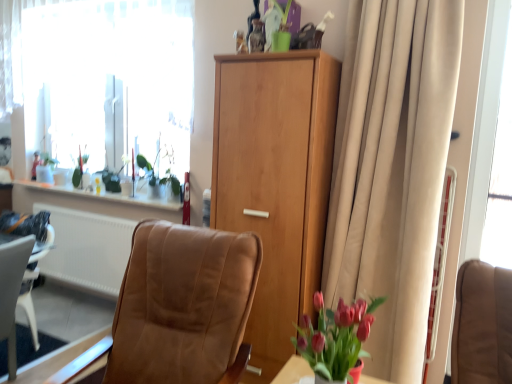
At what (x,y) coordinates should I click in order to perform the action: click on leather-like brown chair at center. Please return your answer as a coordinate pair (x, y). This screenshot has height=384, width=512. Looking at the image, I should click on (179, 308).

How much space does green matte plant at upper left, which is the second plant in left-to-right order, occupy vertically?

green matte plant at upper left, which is the second plant in left-to-right order, is 20.73 inches tall.

This screenshot has height=384, width=512. What do you see at coordinates (276, 183) in the screenshot?
I see `light brown wood cabinet at center` at bounding box center [276, 183].

Measure the distance between light brown wood cabinet at center and camera.

The distance of light brown wood cabinet at center from camera is 2.08 meters.

I want to click on white matte radiator at lower left, so tap(87, 249).

Is white matte radiator at lower left not within beige fabric curtain at right?

white matte radiator at lower left lies outside beige fabric curtain at right's area.

What's the angular difference between white matte radiator at lower left and beige fabric curtain at right's facing directions?

The angle between the facing direction of white matte radiator at lower left and the facing direction of beige fabric curtain at right is 0.869 degrees.

Is white matte radiator at lower left in contact with beige fabric curtain at right?

They are not placed beside each other.

At what (x,y) coordinates should I click in order to perform the action: click on curtain that is above the white matte radiator at lower left (from a real-world perspective). Please return your answer as a coordinate pair (x, y). Looking at the image, I should click on (460, 163).

Identify the location of chair that appears in front of the green matte plant at upper left, which is the second plant in left-to-right order. This screenshot has height=384, width=512. (179, 308).

Can you confirm if leather-like brown chair at center is thinner than green matte plant at upper left, which is the 1th plant from front to back?

No, leather-like brown chair at center is not thinner than green matte plant at upper left, which is the 1th plant from front to back.

From the image's perspective, is leather-like brown chair at center beneath green matte plant at upper left, marked as the first plant in a right-to-left arrangement?

Yes, from the image's perspective, leather-like brown chair at center is beneath green matte plant at upper left, marked as the first plant in a right-to-left arrangement.

From a real-world perspective, is leather-like brown chair at center below green matte plant at upper left, marked as the first plant in a right-to-left arrangement?

Correct, in the physical world, leather-like brown chair at center is lower than green matte plant at upper left, marked as the first plant in a right-to-left arrangement.

Is green glossy vase at upper left, the 1th plant when ordered from left to right, located within leather-like brown chair at center?

No.

In the scene shown: Is leather-like brown chair at center oriented away from green glossy vase at upper left, the 1th plant when ordered from left to right?

leather-like brown chair at center does not have its back to green glossy vase at upper left, the 1th plant when ordered from left to right.

Which object is further away from the camera, leather-like brown chair at center or green glossy vase at upper left, marked as the second plant in a right-to-left arrangement?

green glossy vase at upper left, marked as the second plant in a right-to-left arrangement, is behind.

Considering the sizes of objects beige fabric curtain at right and white matte radiator at lower left in the image provided, who is taller, beige fabric curtain at right or white matte radiator at lower left?

With more height is beige fabric curtain at right.

Can you tell me how much beige fabric curtain at right and white matte radiator at lower left differ in facing direction?

0.869 degrees separate the facing orientations of beige fabric curtain at right and white matte radiator at lower left.

Who is smaller, beige fabric curtain at right or white matte radiator at lower left?

Smaller between the two is white matte radiator at lower left.

Is point (396, 265) closer to camera compared to point (58, 159)?

Yes, it is in front of point (58, 159).

Looking at their sizes, would you say beige fabric curtain at right is wider or thinner than white sheer curtain at upper left?

Considering their sizes, beige fabric curtain at right looks broader than white sheer curtain at upper left.

From the image's perspective, which is below, beige fabric curtain at right or white sheer curtain at upper left?

beige fabric curtain at right appears lower in the image.

Is white sheer curtain at upper left inside beige fabric curtain at right?

No.

Considering the points (73, 212) and (85, 32), which point is in front, point (73, 212) or point (85, 32)?

Positioned in front is point (85, 32).

Is white matte radiator at lower left wider or thinner than white sheer curtain at upper left?

white matte radiator at lower left is thinner than white sheer curtain at upper left.

Which is more to the right, white matte radiator at lower left or white sheer curtain at upper left?

white sheer curtain at upper left.

From a real-world perspective, is transparent glass window screen at right below green matte plant at upper left, marked as the first plant in a right-to-left arrangement?

No, from a real-world perspective, transparent glass window screen at right is not under green matte plant at upper left, marked as the first plant in a right-to-left arrangement.

Is transparent glass window screen at right inside or outside of green matte plant at upper left, which is the second plant in left-to-right order?

transparent glass window screen at right is not inside green matte plant at upper left, which is the second plant in left-to-right order, it's outside.

From the image's perspective, is transparent glass window screen at right beneath green matte plant at upper left, marked as the first plant in a right-to-left arrangement?

No, from the image's perspective, transparent glass window screen at right is not below green matte plant at upper left, marked as the first plant in a right-to-left arrangement.

Does transparent glass window screen at right have a lesser height compared to green matte plant at upper left, which is the second plant in left-to-right order?

No.

This screenshot has width=512, height=384. In order to click on curtain above the white matte radiator at lower left (from a real-world perspective) in this screenshot , I will do [x=460, y=163].

Find the location of a particular element. The image size is (512, 384). chair below the green matte plant at upper left, the 2th plant positioned from the back (from a real-world perspective) is located at coordinates (179, 308).

Which object lies nearer to the anchor point green glossy vase at upper left, which appears as the second plant when viewed from the front, light brown wood cabinet at center or beige fabric curtain at right?

light brown wood cabinet at center.

When comparing their distances from white sheer curtain at upper left, does leather-like brown chair at center or light brown wood cabinet at center seem further?

Based on the image, leather-like brown chair at center appears to be further to white sheer curtain at upper left.

Based on their spatial positions, is light brown wood cabinet at center or green glossy vase at upper left, which is the first plant in back-to-front order, further from white sheer curtain at upper left?

The object further to white sheer curtain at upper left is light brown wood cabinet at center.

Looking at the image, which one is located closer to leather-like brown chair at center, green glossy vase at upper left, marked as the second plant in a right-to-left arrangement, or white matte radiator at lower left?

white matte radiator at lower left.

Considering their positions, is white sheer curtain at upper left positioned further to green matte plant at upper left, which is the second plant in left-to-right order, than transparent glass window screen at right?

transparent glass window screen at right is further to green matte plant at upper left, which is the second plant in left-to-right order.

From the image, which object appears to be farther from green glossy vase at upper left, which appears as the second plant when viewed from the front, leather-like brown chair at center or transparent glass window screen at right?

Based on the image, transparent glass window screen at right appears to be further to green glossy vase at upper left, which appears as the second plant when viewed from the front.

Estimate the real-world distances between objects in this image. Which object is further from green glossy vase at upper left, which appears as the second plant when viewed from the front, green matte plant at upper left, which is the 1th plant from front to back, or light brown wood cabinet at center?

light brown wood cabinet at center.

Estimate the real-world distances between objects in this image. Which object is closer to beige fabric curtain at right, green matte plant at upper left, which is the second plant in left-to-right order, or leather-like brown chair at center?

leather-like brown chair at center is positioned closer to the anchor beige fabric curtain at right.

You are a GUI agent. You are given a task and a screenshot of the screen. Output one action in this format:
    pyautogui.click(x=<x>, y=<y>)
    Task: Click on the curtain between green matte plant at upper left, which is the 1th plant from front to back, and transparent glass window screen at right, in the horizontal direction
    Image resolution: width=512 pixels, height=384 pixels.
    Given the screenshot: What is the action you would take?
    pyautogui.click(x=460, y=163)

Identify the location of cabinetry situated between leather-like brown chair at center and transparent glass window screen at right from left to right. This screenshot has height=384, width=512. (276, 183).

Identify the location of cabinetry located between white sheer curtain at upper left and beige fabric curtain at right in the left-right direction. This screenshot has height=384, width=512. (276, 183).

What are the coordinates of `window situated between white matte radiator at lower left and transparent glass window screen at right from left to right` in the screenshot? It's located at (106, 82).